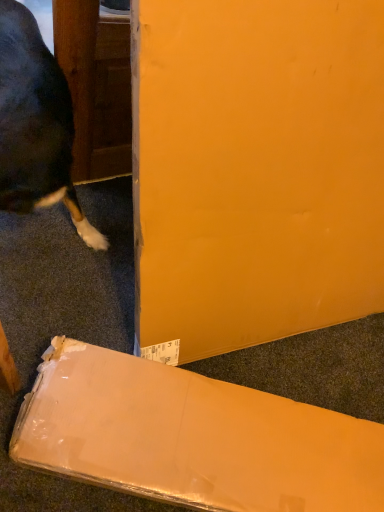
Where is `matte cardboard box at lower center`? This screenshot has width=384, height=512. matte cardboard box at lower center is located at coordinates (192, 437).

Measure the distance between point (298, 477) and camera.

Point (298, 477) is 37.91 inches away from camera.

Image resolution: width=384 pixels, height=512 pixels. Describe the element at coordinates (192, 437) in the screenshot. I see `matte cardboard box at lower center` at that location.

Where is `matte cardboard box at lower center`? The image size is (384, 512). matte cardboard box at lower center is located at coordinates (192, 437).